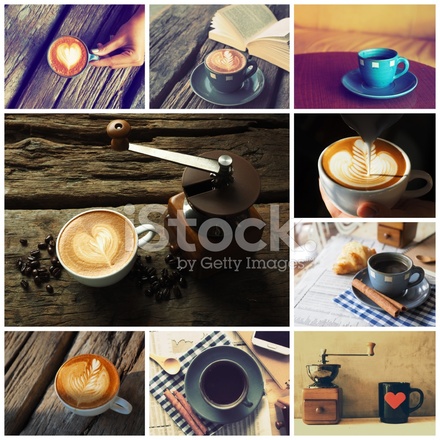
Find the location of a particular element. coffee cup handles is located at coordinates (252, 69), (405, 68), (148, 229), (125, 407), (248, 402), (419, 272), (422, 176).